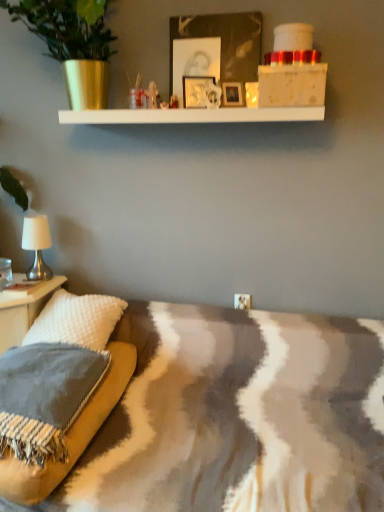
Question: Can you confirm if white textured pillow at left is shorter than textured gray pillow at lower left?

Choices:
 (A) yes
 (B) no

Answer: (B)

Question: Is white textured pillow at left placed right next to textured gray pillow at lower left?

Choices:
 (A) yes
 (B) no

Answer: (B)

Question: Does white textured pillow at left have a lesser width compared to textured gray pillow at lower left?

Choices:
 (A) no
 (B) yes

Answer: (B)

Question: Does white textured pillow at left appear on the right side of textured gray pillow at lower left?

Choices:
 (A) no
 (B) yes

Answer: (A)

Question: Considering the relative sizes of white textured pillow at left and textured gray pillow at lower left in the image provided, is white textured pillow at left smaller than textured gray pillow at lower left?

Choices:
 (A) yes
 (B) no

Answer: (B)

Question: From a real-world perspective, is white fabric lampshade at left positioned above or below white textured pillow at left?

Choices:
 (A) above
 (B) below

Answer: (A)

Question: Considering the positions of white fabric lampshade at left and white textured pillow at left in the image, is white fabric lampshade at left bigger or smaller than white textured pillow at left?

Choices:
 (A) small
 (B) big

Answer: (A)

Question: Considering the relative positions of white fabric lampshade at left and white textured pillow at left in the image provided, is white fabric lampshade at left to the left or to the right of white textured pillow at left?

Choices:
 (A) left
 (B) right

Answer: (A)

Question: Considering their positions, is white fabric lampshade at left located in front of or behind white textured pillow at left?

Choices:
 (A) behind
 (B) front

Answer: (A)

Question: Is white fabric lampshade at left spatially inside metallic silver picture frame at upper center, or outside of it?

Choices:
 (A) outside
 (B) inside

Answer: (A)

Question: From a real-world perspective, relative to metallic silver picture frame at upper center, is white fabric lampshade at left vertically above or below?

Choices:
 (A) above
 (B) below

Answer: (B)

Question: From the image's perspective, is white fabric lampshade at left positioned above or below metallic silver picture frame at upper center?

Choices:
 (A) below
 (B) above

Answer: (A)

Question: Is point (41, 267) positioned closer to the camera than point (183, 96)?

Choices:
 (A) farther
 (B) closer

Answer: (A)

Question: Is textured gray pillow at lower left wider or thinner than metallic silver picture frame at upper center?

Choices:
 (A) wide
 (B) thin

Answer: (A)

Question: Would you say textured gray pillow at lower left is to the left or to the right of metallic silver picture frame at upper center in the picture?

Choices:
 (A) right
 (B) left

Answer: (B)